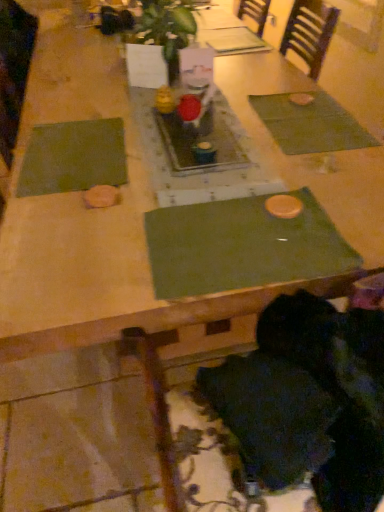
I want to click on free spot below green fabric place mat at center, which appears as the second place mat when viewed from the left (from a real-world perspective), so [x=241, y=239].